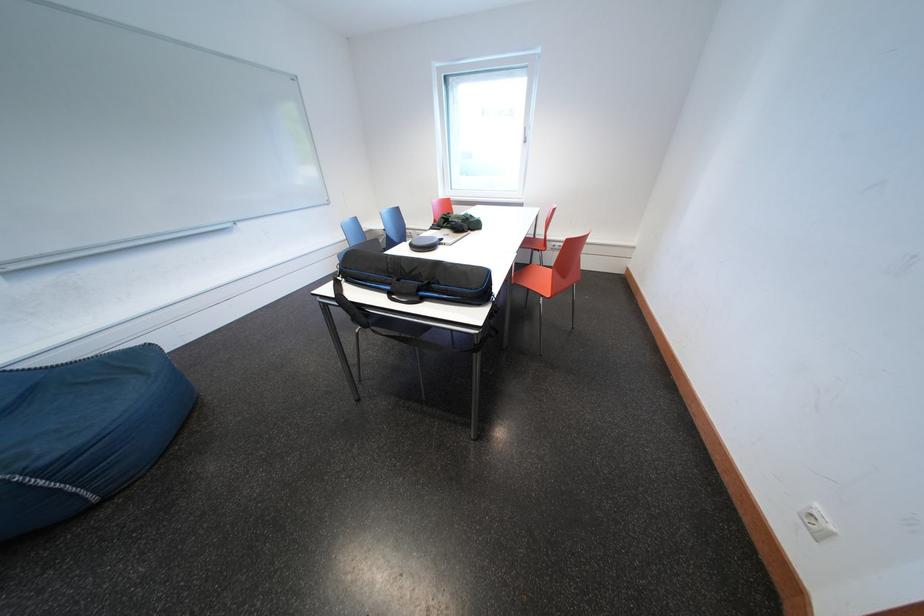
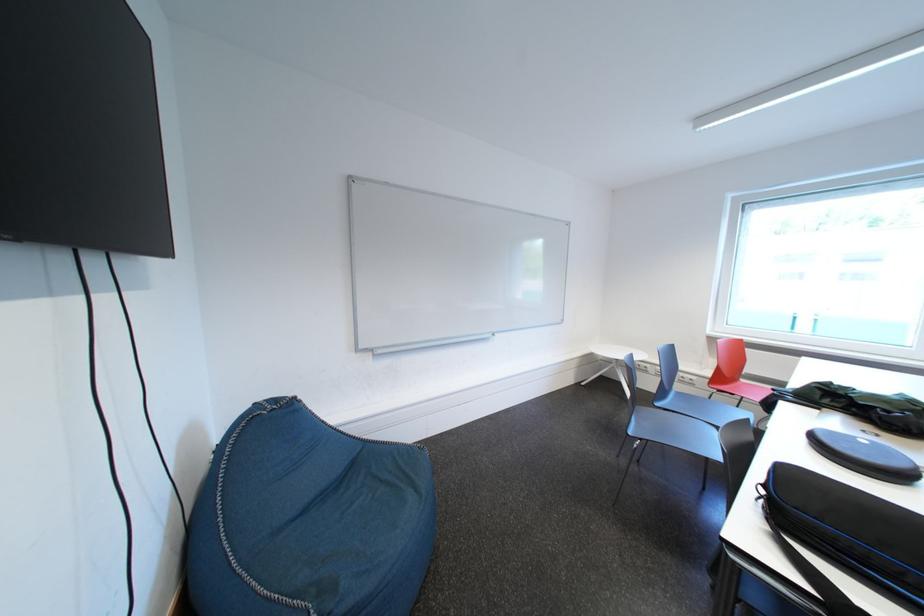
Question: I am providing you with two images of the same scene from different viewpoints. Please identify which objects are invisible in image2.

Choices:
 (A) blue beanbag surface
 (B) black zippered case
 (C) red chair sitting surface
 (D) none of these

Answer: (D)